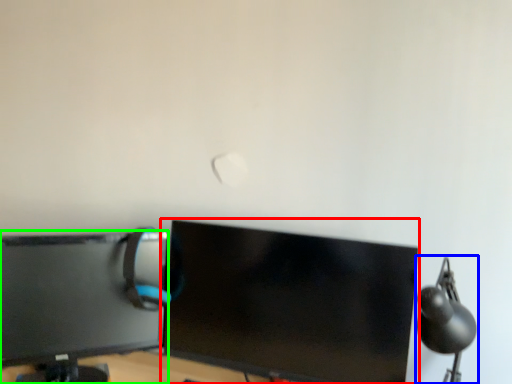
Question: Which is nearer to the computer monitor (highlighted by a red box)? table lamp (highlighted by a blue box) or computer monitor (highlighted by a green box).

Choices:
 (A) table lamp
 (B) computer monitor

Answer: (B)